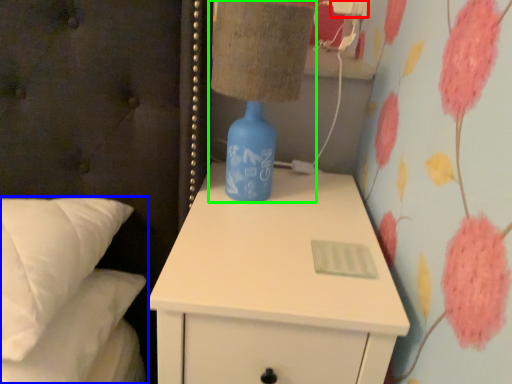
Question: Considering the real-world distances, which object is farthest from electric outlet (highlighted by a red box)? bed (highlighted by a blue box) or table lamp (highlighted by a green box)?

Choices:
 (A) bed
 (B) table lamp

Answer: (A)